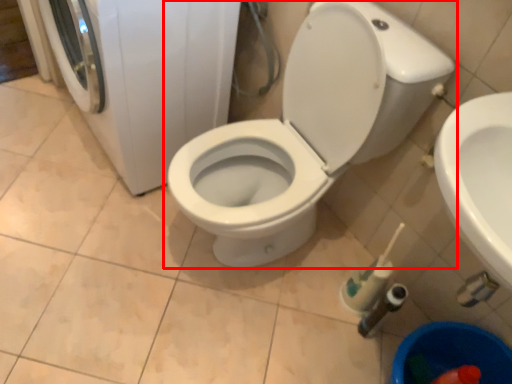
Question: In this image, where is toilet (annotated by the red box) located relative to washing machine?

Choices:
 (A) right
 (B) left

Answer: (A)